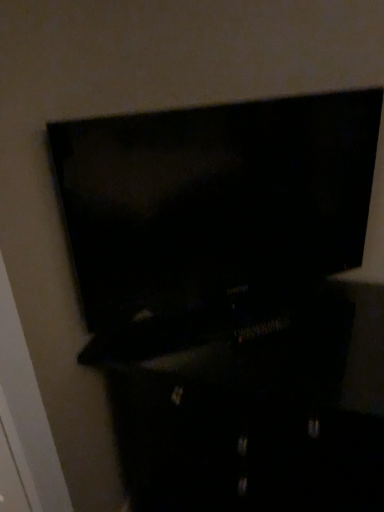
Question: Does matte black tv at upper center have a lesser width compared to black glossy dresser at center?

Choices:
 (A) yes
 (B) no

Answer: (A)

Question: From the image's perspective, is matte black tv at upper center over black glossy dresser at center?

Choices:
 (A) yes
 (B) no

Answer: (A)

Question: Is the position of matte black tv at upper center less distant than that of black glossy dresser at center?

Choices:
 (A) no
 (B) yes

Answer: (B)

Question: Does matte black tv at upper center have a greater height compared to black glossy dresser at center?

Choices:
 (A) yes
 (B) no

Answer: (B)

Question: Could you tell me if matte black tv at upper center is turned towards black glossy dresser at center?

Choices:
 (A) no
 (B) yes

Answer: (A)

Question: Is matte black tv at upper center not inside black glossy dresser at center?

Choices:
 (A) yes
 (B) no

Answer: (A)

Question: Does black glossy dresser at center come in front of matte black tv at upper center?

Choices:
 (A) no
 (B) yes

Answer: (A)

Question: Does black glossy dresser at center have a larger size compared to matte black tv at upper center?

Choices:
 (A) no
 (B) yes

Answer: (B)

Question: Is matte black tv at upper center located within black glossy dresser at center?

Choices:
 (A) no
 (B) yes

Answer: (A)

Question: Is black glossy dresser at center not inside matte black tv at upper center?

Choices:
 (A) no
 (B) yes

Answer: (B)

Question: Does black glossy dresser at center come behind matte black tv at upper center?

Choices:
 (A) no
 (B) yes

Answer: (B)

Question: Does black glossy dresser at center have a smaller size compared to matte black tv at upper center?

Choices:
 (A) yes
 (B) no

Answer: (B)

Question: From a real-world perspective, is matte black tv at upper center positioned above or below black glossy dresser at center?

Choices:
 (A) above
 (B) below

Answer: (A)